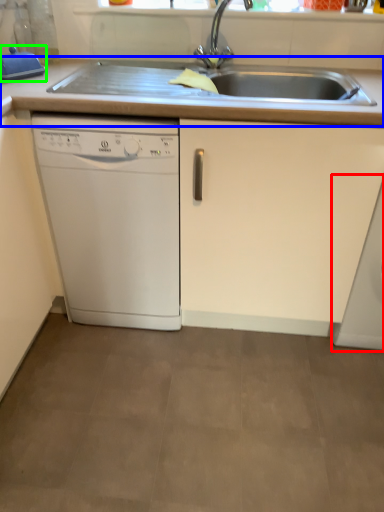
Question: Based on their relative distances, which object is farther from washing machine (highlighted by a red box)? Choose from countertop (highlighted by a blue box) and appliance (highlighted by a green box).

Choices:
 (A) countertop
 (B) appliance

Answer: (B)